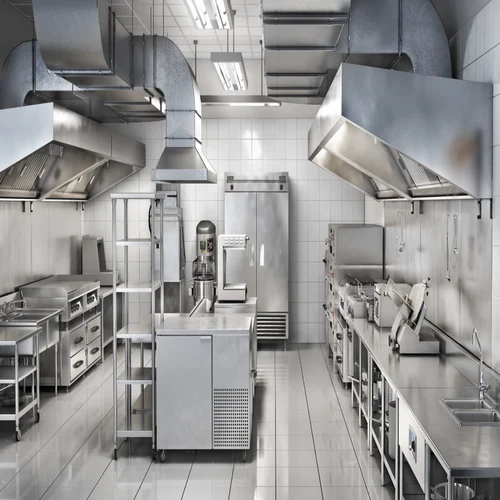
Locate an element on the screen. Image resolution: width=500 pixels, height=500 pixels. sink is located at coordinates (458, 402), (463, 418).